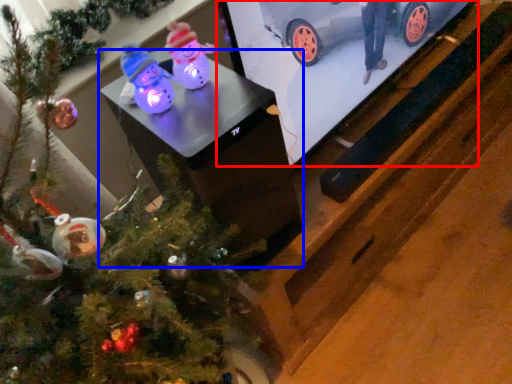
Question: Which of the following is the farthest to the observer, tv show (highlighted by a red box) or table (highlighted by a blue box)?

Choices:
 (A) tv show
 (B) table

Answer: (A)